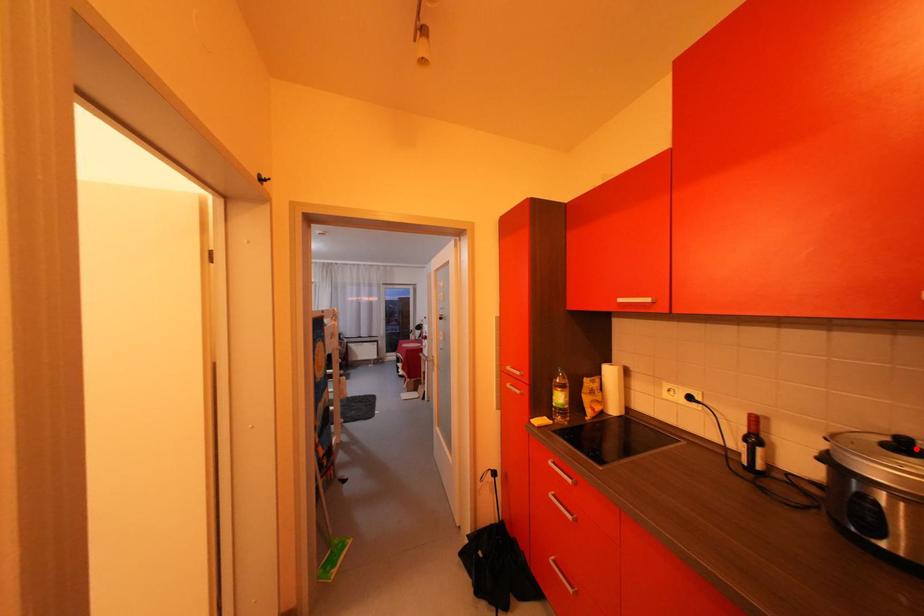
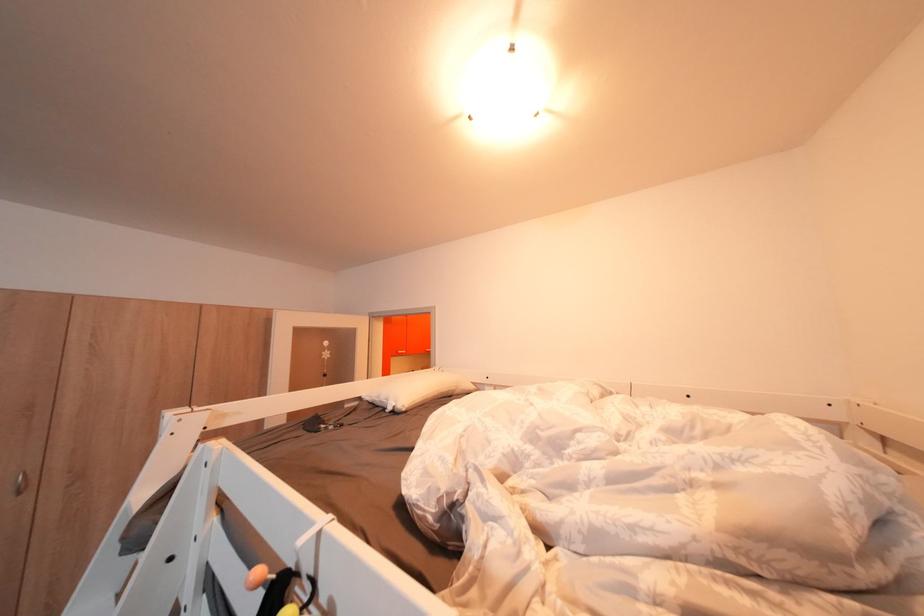
Question: I am providing you with two images of the same scene from different viewpoints. A red point is marked on the first image. Is the red point's position out of view in image 2?

Choices:
 (A) Yes
 (B) No

Answer: (A)